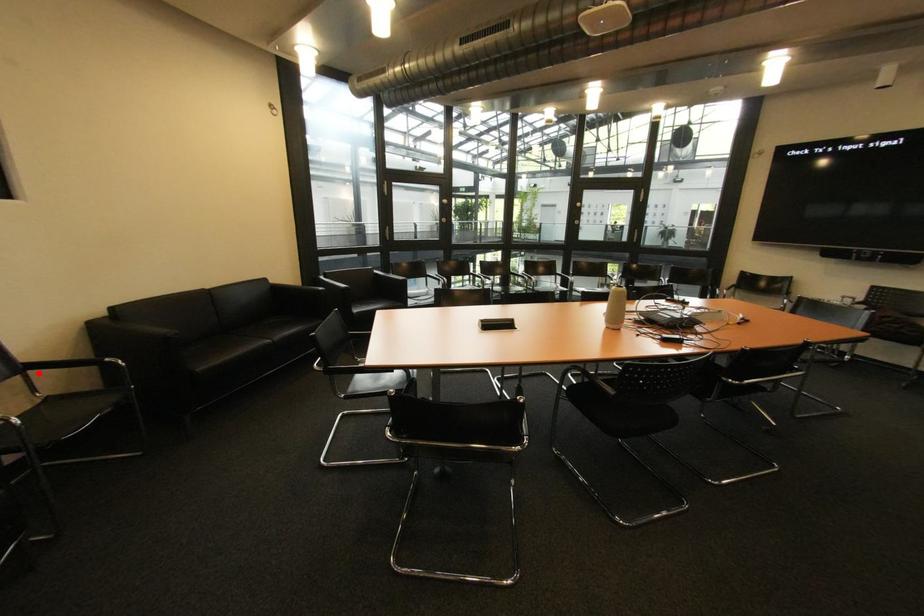
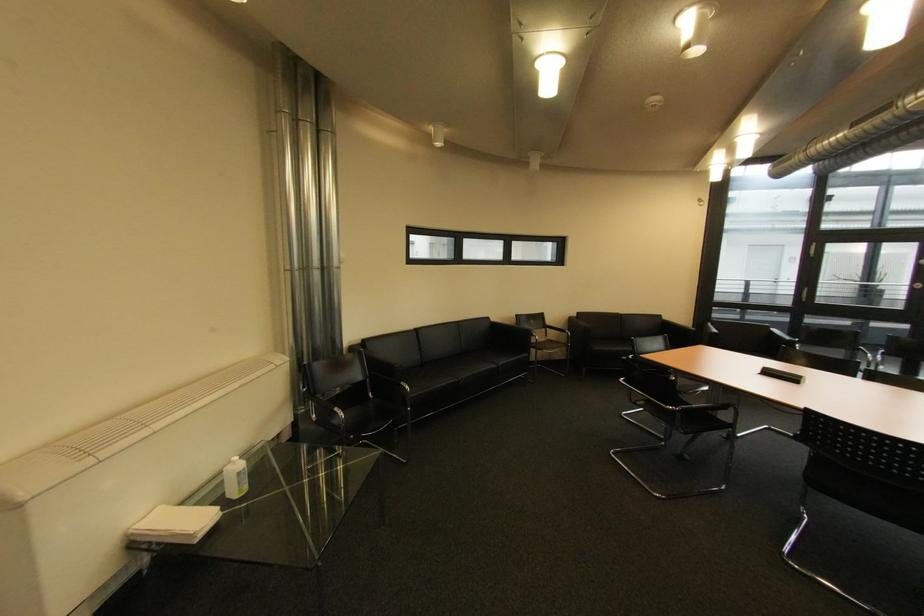
In the second image, find the point that corresponds to the highlighted location in the first image.

(555, 330)